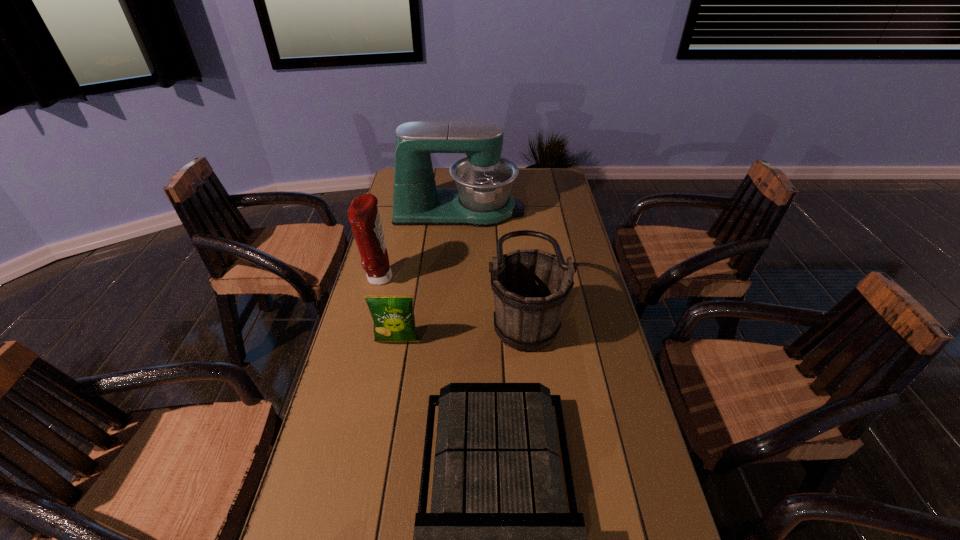
At what (x,y) coordinates should I click in order to perform the action: click on object that is at the far edge. Please return your answer as a coordinate pair (x, y). The image size is (960, 540). Looking at the image, I should click on (482, 198).

Locate an element on the screen. This screenshot has width=960, height=540. mixer that is at the left edge is located at coordinates (482, 198).

You are a GUI agent. You are given a task and a screenshot of the screen. Output one action in this format:
    pyautogui.click(x=<x>, y=<y>)
    Task: Click on the condiment that is positioned at the left edge
    
    Given the screenshot: What is the action you would take?
    pyautogui.click(x=363, y=214)

The width and height of the screenshot is (960, 540). In order to click on crisp (potato chip) that is at the left edge in this screenshot , I will do `click(393, 315)`.

Identify the location of object that is positioned at the right edge. The width and height of the screenshot is (960, 540). (531, 286).

The image size is (960, 540). What are the coordinates of `object that is at the far left corner` in the screenshot? It's located at (482, 198).

The width and height of the screenshot is (960, 540). I want to click on free space at the far edge of the desktop, so click(x=525, y=177).

Locate an element on the screen. vacant space at the left edge is located at coordinates (413, 230).

Where is `blank space at the right edge`? blank space at the right edge is located at coordinates (588, 350).

You are a GUI agent. You are given a task and a screenshot of the screen. Output one action in this format:
    pyautogui.click(x=<x>, y=<y>)
    Task: Click on the free spot between the farthest object and the second tallest object
    This screenshot has height=540, width=960.
    Given the screenshot: What is the action you would take?
    pyautogui.click(x=420, y=244)